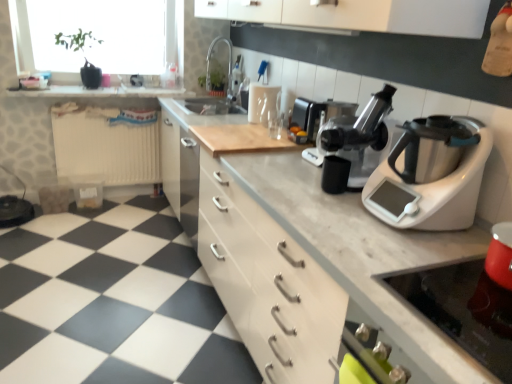
The height and width of the screenshot is (384, 512). What are the coordinates of `free space that is to the left of silver metallic food processor at right` in the screenshot? It's located at (328, 210).